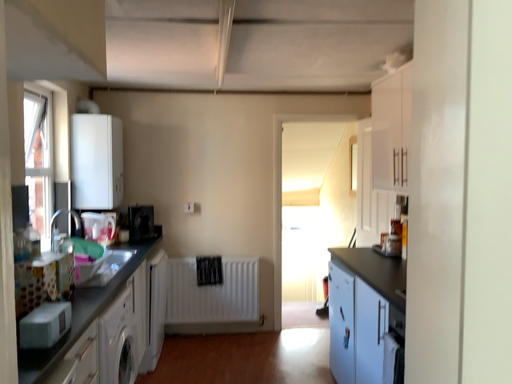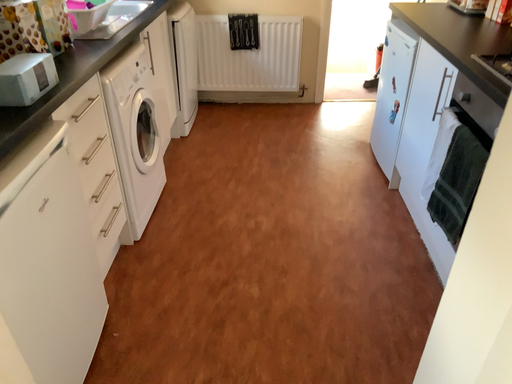
Question: Which way did the camera rotate in the video?

Choices:
 (A) rotated upward
 (B) rotated downward

Answer: (B)